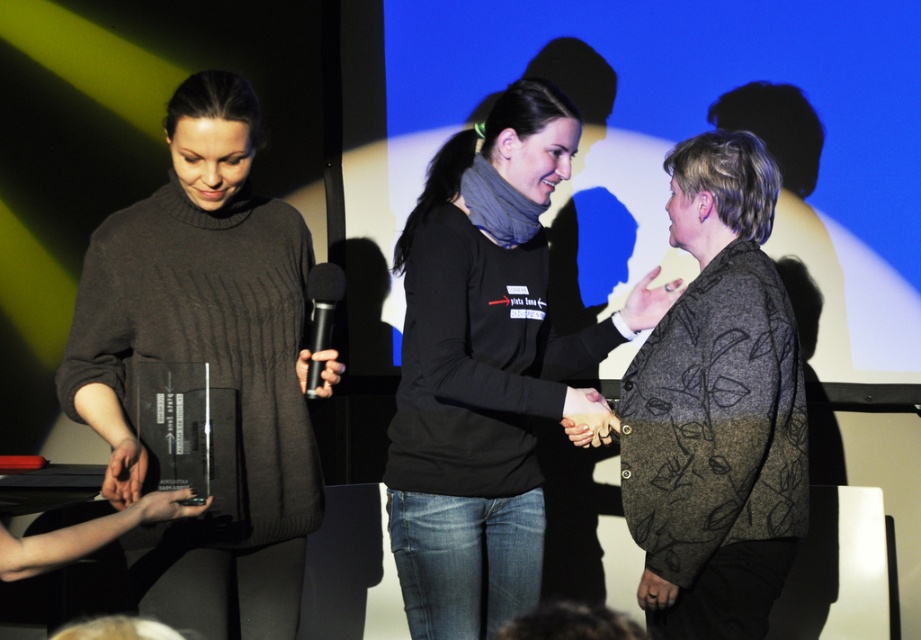
Question: Where is knitted dark gray sweater at center located in relation to black matte microphone at center in the image?

Choices:
 (A) right
 (B) left

Answer: (B)

Question: Which object is closer to the camera taking this photo?

Choices:
 (A) floral-patterned woolen jacket at center
 (B) black matte shirt at center
 (C) knitted dark gray sweater at center
 (D) black matte microphone at center

Answer: (C)

Question: Is knitted dark gray sweater at center to the right of floral-patterned woolen jacket at center from the viewer's perspective?

Choices:
 (A) yes
 (B) no

Answer: (B)

Question: Does black matte shirt at center appear on the right side of black matte microphone at center?

Choices:
 (A) yes
 (B) no

Answer: (A)

Question: Which point is farther from the camera taking this photo?

Choices:
 (A) (309, 381)
 (B) (504, 291)
 (C) (194, 241)

Answer: (B)

Question: Among these objects, which one is farthest from the camera?

Choices:
 (A) black matte shirt at center
 (B) floral-patterned woolen jacket at center
 (C) black matte microphone at center

Answer: (A)